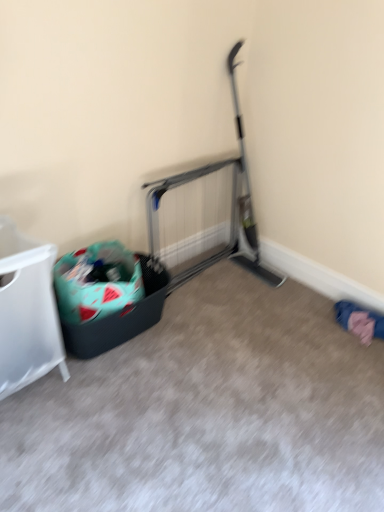
Describe the element at coordinates (107, 296) in the screenshot. The width and height of the screenshot is (384, 512). I see `teal fabric recycling bin at left` at that location.

In order to click on white plastic laundry basket at left in this screenshot , I will do `click(27, 311)`.

Where is `teal fabric recycling bin at left`? This screenshot has height=512, width=384. teal fabric recycling bin at left is located at coordinates (107, 296).

The height and width of the screenshot is (512, 384). What are the coordinates of `clothing on the right of white plastic laundry basket at left` in the screenshot? It's located at (358, 311).

Is point (18, 245) closer or farther from the camera than point (377, 337)?

Clearly, point (18, 245) is closer to the camera than point (377, 337).

Can you confirm if white plastic laundry basket at left is positioned to the right of pink fabric at lower right?

In fact, white plastic laundry basket at left is to the left of pink fabric at lower right.

From the image's perspective, is white plastic laundry basket at left below pink fabric at lower right?

No, from the image's perspective, white plastic laundry basket at left is not below pink fabric at lower right.

Is teal fabric recycling bin at left shorter than white plastic laundry basket at left?

Indeed, teal fabric recycling bin at left has a lesser height compared to white plastic laundry basket at left.

Considering the sizes of teal fabric recycling bin at left and white plastic laundry basket at left in the image, is teal fabric recycling bin at left wider or thinner than white plastic laundry basket at left?

Clearly, teal fabric recycling bin at left has more width compared to white plastic laundry basket at left.

From the image's perspective, which one is positioned lower, teal fabric recycling bin at left or white plastic laundry basket at left?

From the image's view, teal fabric recycling bin at left is below.

Can you confirm if teal fabric recycling bin at left is smaller than white plastic laundry basket at left?

Yes.

Is pink fabric at lower right to the left or to the right of white plastic laundry basket at left in the image?

Clearly, pink fabric at lower right is on the right of white plastic laundry basket at left in the image.

Considering the positions of objects pink fabric at lower right and white plastic laundry basket at left in the image provided, who is behind, pink fabric at lower right or white plastic laundry basket at left?

pink fabric at lower right is behind.

Is pink fabric at lower right next to white plastic laundry basket at left?

pink fabric at lower right and white plastic laundry basket at left are not in contact.

Is point (338, 315) positioned behind point (34, 289)?

Yes, point (338, 315) is behind point (34, 289).

Looking at this image, is teal fabric recycling bin at left outside of pink fabric at lower right?

Yes.

How far apart are teal fabric recycling bin at left and pink fabric at lower right?

1.17 meters.

Considering the relative sizes of teal fabric recycling bin at left and pink fabric at lower right in the image provided, is teal fabric recycling bin at left thinner than pink fabric at lower right?

No, teal fabric recycling bin at left is not thinner than pink fabric at lower right.

Between teal fabric recycling bin at left and pink fabric at lower right, which one has larger size?

Bigger between the two is teal fabric recycling bin at left.

Who is bigger, white plastic laundry basket at left or teal fabric recycling bin at left?

Bigger between the two is white plastic laundry basket at left.

Who is taller, white plastic laundry basket at left or teal fabric recycling bin at left?

Standing taller between the two is white plastic laundry basket at left.

How many degrees apart are the facing directions of white plastic laundry basket at left and teal fabric recycling bin at left?

The angular difference between white plastic laundry basket at left and teal fabric recycling bin at left is 0.261 degrees.

Looking at this image, how much distance is there between white plastic laundry basket at left and teal fabric recycling bin at left?

white plastic laundry basket at left and teal fabric recycling bin at left are 11.17 inches apart from each other.

Would you say pink fabric at lower right is to the left or to the right of teal fabric recycling bin at left in the picture?

From the image, it's evident that pink fabric at lower right is to the right of teal fabric recycling bin at left.

Can teal fabric recycling bin at left be found inside pink fabric at lower right?

No, pink fabric at lower right does not contain teal fabric recycling bin at left.

From the image's perspective, does pink fabric at lower right appear lower than teal fabric recycling bin at left?

Yes, from the image's perspective, pink fabric at lower right is below teal fabric recycling bin at left.

Which is closer, (352, 306) or (139, 306)?

Positioned in front is point (139, 306).

At what (x,y) coordinates should I click in order to perform the action: click on clothing behind the white plastic laundry basket at left. Please return your answer as a coordinate pair (x, y). This screenshot has height=512, width=384. Looking at the image, I should click on coord(358,311).

At what (x,y) coordinates should I click in order to perform the action: click on recycling bin on the right side of white plastic laundry basket at left. Please return your answer as a coordinate pair (x, y). Looking at the image, I should click on pyautogui.click(x=107, y=296).

Considering their positions, is white plastic laundry basket at left positioned further to pink fabric at lower right than teal fabric recycling bin at left?

white plastic laundry basket at left is positioned further to the anchor pink fabric at lower right.

Based on the photo, looking at the image, which one is located closer to teal fabric recycling bin at left, pink fabric at lower right or white plastic laundry basket at left?

Based on the image, white plastic laundry basket at left appears to be nearer to teal fabric recycling bin at left.

Looking at the image, which one is located closer to white plastic laundry basket at left, pink fabric at lower right or teal fabric recycling bin at left?

Based on the image, teal fabric recycling bin at left appears to be nearer to white plastic laundry basket at left.

Considering their positions, is teal fabric recycling bin at left positioned closer to pink fabric at lower right than white plastic laundry basket at left?

teal fabric recycling bin at left is positioned closer to the anchor pink fabric at lower right.

When comparing their distances from teal fabric recycling bin at left, does white plastic laundry basket at left or pink fabric at lower right seem further?

Based on the image, pink fabric at lower right appears to be further to teal fabric recycling bin at left.

Which object lies nearer to the anchor point white plastic laundry basket at left, teal fabric recycling bin at left or pink fabric at lower right?

teal fabric recycling bin at left.

The width and height of the screenshot is (384, 512). Identify the location of recycling bin located between white plastic laundry basket at left and pink fabric at lower right in the left-right direction. (107, 296).